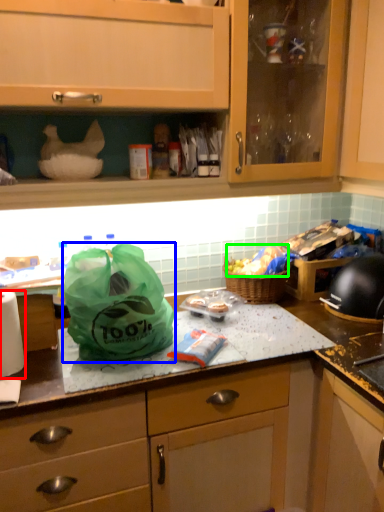
Question: Based on their relative distances, which object is farther from paper towel (highlighted by a red box)? Choose from plastic bag (highlighted by a blue box) and food (highlighted by a green box).

Choices:
 (A) plastic bag
 (B) food

Answer: (B)